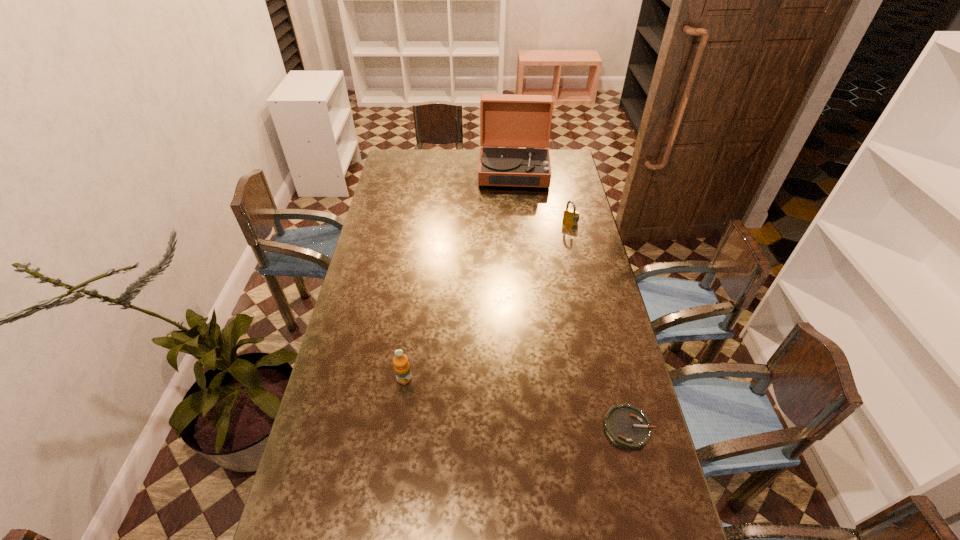
At what (x,y) coordinates should I click in order to perform the action: click on vacant space in between the farthest object and the leftmost object. Please return your answer as a coordinate pair (x, y). Image resolution: width=960 pixels, height=540 pixels. Looking at the image, I should click on (459, 275).

Identify the location of vacant space that's between the orange juice and the farthest object. (459, 275).

What are the coordinates of `vacant space that's between the second shortest object and the third shortest object` in the screenshot? It's located at pyautogui.click(x=488, y=301).

Where is `vacant area that lies between the ashtray and the padlock`? Image resolution: width=960 pixels, height=540 pixels. vacant area that lies between the ashtray and the padlock is located at coordinates (600, 325).

The height and width of the screenshot is (540, 960). I want to click on vacant space in between the second shortest object and the second nearest object, so click(x=488, y=301).

Image resolution: width=960 pixels, height=540 pixels. Identify the location of free space between the tallest object and the shortest object. (571, 300).

Locate which object is the second closest to the third shortest object. Please provide its 2D coordinates. Your answer should be formatted as a tuple, i.e. [(x, y)], where the tuple contains the x and y coordinates of a point satisfying the conditions above.

[(571, 216)]

Choose which object is the second nearest neighbor to the ashtray. Please provide its 2D coordinates. Your answer should be formatted as a tuple, i.e. [(x, y)], where the tuple contains the x and y coordinates of a point satisfying the conditions above.

[(571, 216)]

Where is `free space that satisfies the following two spatial constraints: 1. on the label of the ashtray; 2. on the right side of the orange juice`? Image resolution: width=960 pixels, height=540 pixels. free space that satisfies the following two spatial constraints: 1. on the label of the ashtray; 2. on the right side of the orange juice is located at coordinates (397, 428).

Where is `vacant space that satisfies the following two spatial constraints: 1. on the front side of the shortest object; 2. on the right side of the second farthest object`? The height and width of the screenshot is (540, 960). vacant space that satisfies the following two spatial constraints: 1. on the front side of the shortest object; 2. on the right side of the second farthest object is located at coordinates (618, 428).